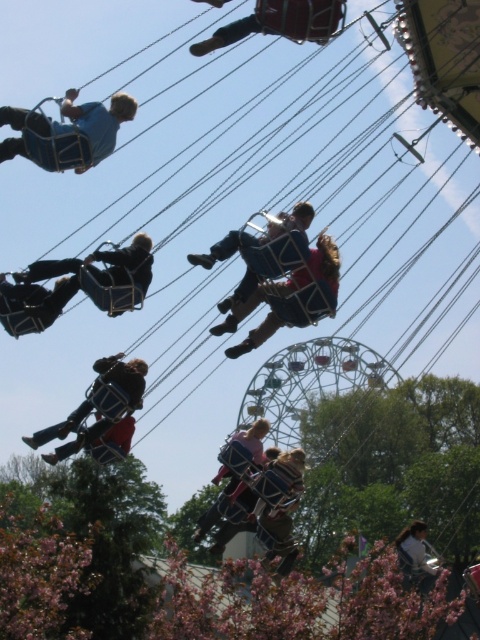
Does matte black harness at left come in front of metallic blue helmet at lower left?

Yes.

Is matte black harness at left bigger than metallic blue helmet at lower left?

Incorrect, matte black harness at left is not larger than metallic blue helmet at lower left.

You are a GUI agent. You are given a task and a screenshot of the screen. Output one action in this format:
    pyautogui.click(x=<x>, y=<y>)
    Task: Click on the matte black harness at left
    The width and height of the screenshot is (480, 640).
    Given the screenshot: What is the action you would take?
    pyautogui.click(x=91, y=273)

Locate an element on the screen. The image size is (480, 640). matte black harness at left is located at coordinates (91, 273).

Is matte blue harness at upper left bigger than matte blue chair at center?

Incorrect, matte blue harness at upper left is not larger than matte blue chair at center.

Who is positioned more to the left, matte blue harness at upper left or matte blue chair at center?

From the viewer's perspective, matte blue harness at upper left appears more on the left side.

This screenshot has width=480, height=640. I want to click on matte blue harness at upper left, so click(x=66, y=132).

Image resolution: width=480 pixels, height=640 pixels. What do you see at coordinates (289, 298) in the screenshot?
I see `metallic blue harness at center` at bounding box center [289, 298].

Locate an element on the screen. metallic blue harness at center is located at coordinates (289, 298).

Locate an element on the screen. Image resolution: width=480 pixels, height=640 pixels. metallic blue harness at center is located at coordinates (289, 298).